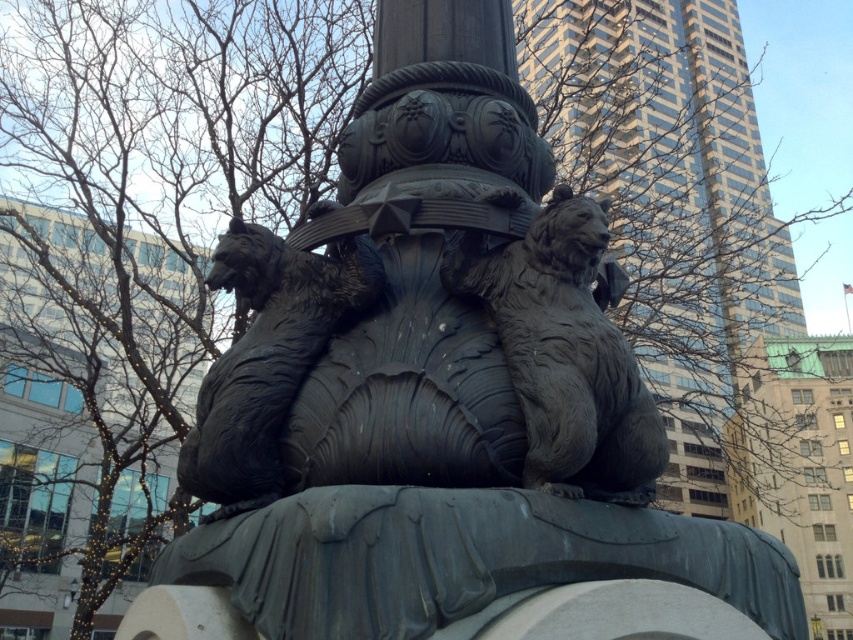
Which of these two, matte gray lion at center or matte bronze lion at center, stands shorter?

matte bronze lion at center

The height and width of the screenshot is (640, 853). Describe the element at coordinates (566, 352) in the screenshot. I see `matte gray lion at center` at that location.

At what (x,y) coordinates should I click in order to perform the action: click on matte gray lion at center. Please return your answer as a coordinate pair (x, y). Looking at the image, I should click on (566, 352).